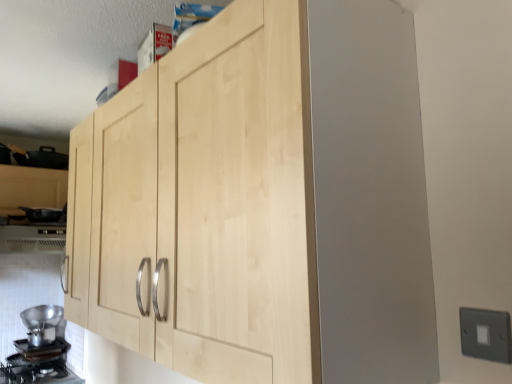
Question: Are metallic silver funnel at lower left and black matte gas stove at lower left beside each other?

Choices:
 (A) no
 (B) yes

Answer: (A)

Question: Considering the relative sizes of metallic silver funnel at lower left and black matte gas stove at lower left in the image provided, is metallic silver funnel at lower left wider than black matte gas stove at lower left?

Choices:
 (A) yes
 (B) no

Answer: (B)

Question: Is metallic silver funnel at lower left positioned with its back to black matte gas stove at lower left?

Choices:
 (A) no
 (B) yes

Answer: (A)

Question: Does metallic silver funnel at lower left have a greater height compared to black matte gas stove at lower left?

Choices:
 (A) yes
 (B) no

Answer: (A)

Question: Would you say metallic silver funnel at lower left is outside black matte gas stove at lower left?

Choices:
 (A) no
 (B) yes

Answer: (B)

Question: From a real-world perspective, is metallic silver funnel at lower left above or below gray plastic switch at lower right?

Choices:
 (A) above
 (B) below

Answer: (B)

Question: Considering the positions of metallic silver funnel at lower left and gray plastic switch at lower right in the image, is metallic silver funnel at lower left taller or shorter than gray plastic switch at lower right?

Choices:
 (A) short
 (B) tall

Answer: (B)

Question: Is metallic silver funnel at lower left bigger or smaller than gray plastic switch at lower right?

Choices:
 (A) big
 (B) small

Answer: (A)

Question: Relative to gray plastic switch at lower right, is metallic silver funnel at lower left in front or behind?

Choices:
 (A) behind
 (B) front

Answer: (A)

Question: Is point (256, 200) closer or farther from the camera than point (55, 243)?

Choices:
 (A) farther
 (B) closer

Answer: (B)

Question: From the image's perspective, relative to metallic silver vent at lower left, is natural wood cabinet at center above or below?

Choices:
 (A) below
 (B) above

Answer: (B)

Question: In the image, is natural wood cabinet at center on the left side or the right side of metallic silver vent at lower left?

Choices:
 (A) left
 (B) right

Answer: (B)

Question: From a real-world perspective, is natural wood cabinet at center positioned above or below metallic silver vent at lower left?

Choices:
 (A) above
 (B) below

Answer: (A)

Question: From the image's perspective, is black matte gas stove at lower left located above or below metallic silver vent at lower left?

Choices:
 (A) below
 (B) above

Answer: (A)

Question: Is black matte gas stove at lower left situated inside metallic silver vent at lower left or outside?

Choices:
 (A) inside
 (B) outside

Answer: (B)